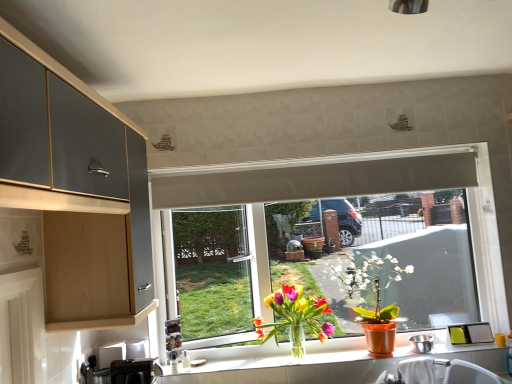
At what (x,y) coordinates should I click in order to perform the action: click on vacant area to the right of metallic stainless steel bowl at window, marked as the 2th appliance in a front-to-back arrangement. Please return your answer as a coordinate pair (x, y). Looking at the image, I should click on (455, 354).